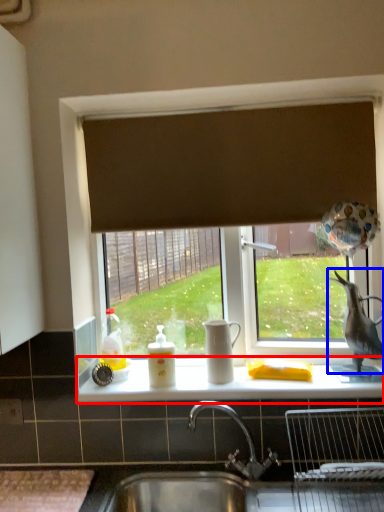
Question: Among these objects, which one is farthest to the camera, counter top (highlighted by a red box) or animal (highlighted by a blue box)?

Choices:
 (A) counter top
 (B) animal

Answer: (B)